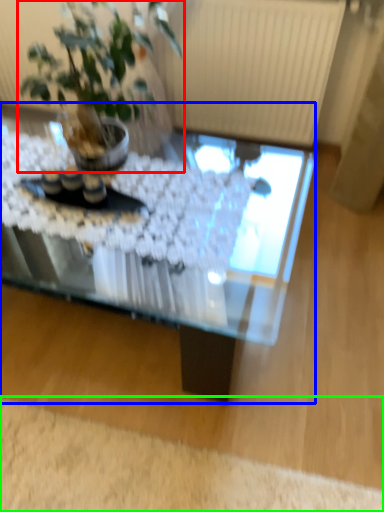
Question: Which object is the closest to the houseplant (highlighted by a red box)? Choose among these: coffee table (highlighted by a blue box) or plain (highlighted by a green box).

Choices:
 (A) coffee table
 (B) plain

Answer: (A)